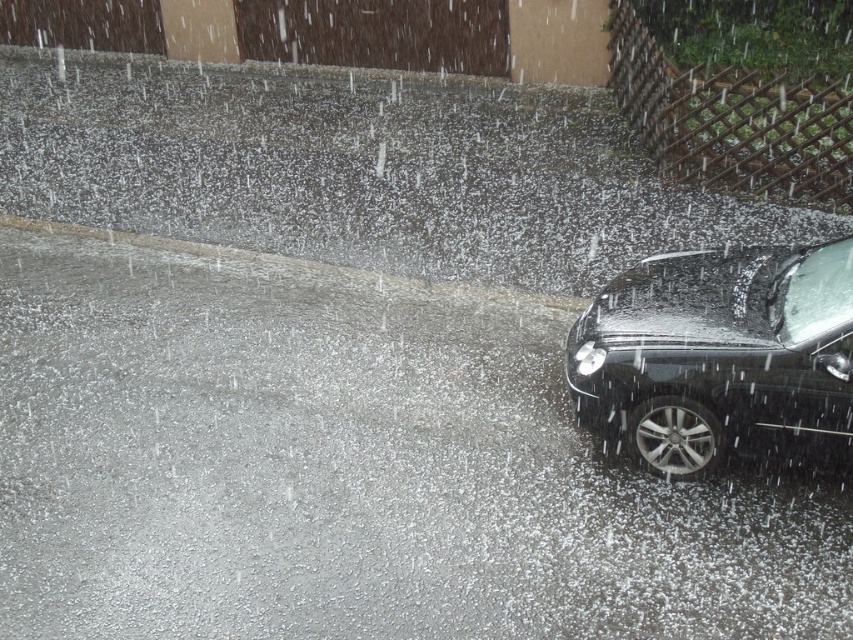
You are standing on the wet, reflective paved ground and see a point marked at coordinates (721, 356). What object does this point correspond to?

The point at (721, 356) corresponds to the glossy black car at right.

You are standing at the camera position and want to walk towards the two points in the image. Which point will you reach first, point (567, 376) or point (469, 292)?

Point (567, 376) is closer to the camera than point (469, 292), so you will reach point (567, 376) first.

You are standing on the gray concrete curb at lower left and want to walk to the glossy black car at right. Which direction should you move to reach the car?

The glossy black car at right is below the gray concrete curb at lower left, so you should move downward to reach it.